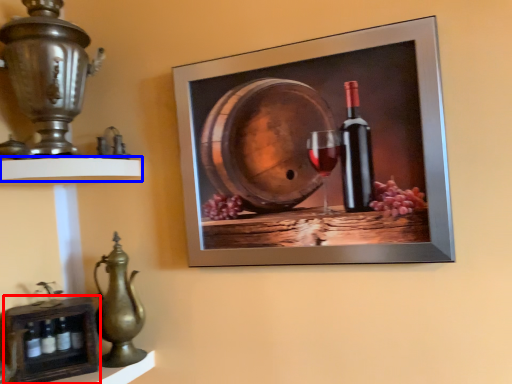
Question: Which of the following is the closest to the observer, shelf (highlighted by a red box) or shelf (highlighted by a blue box)?

Choices:
 (A) shelf
 (B) shelf

Answer: (B)